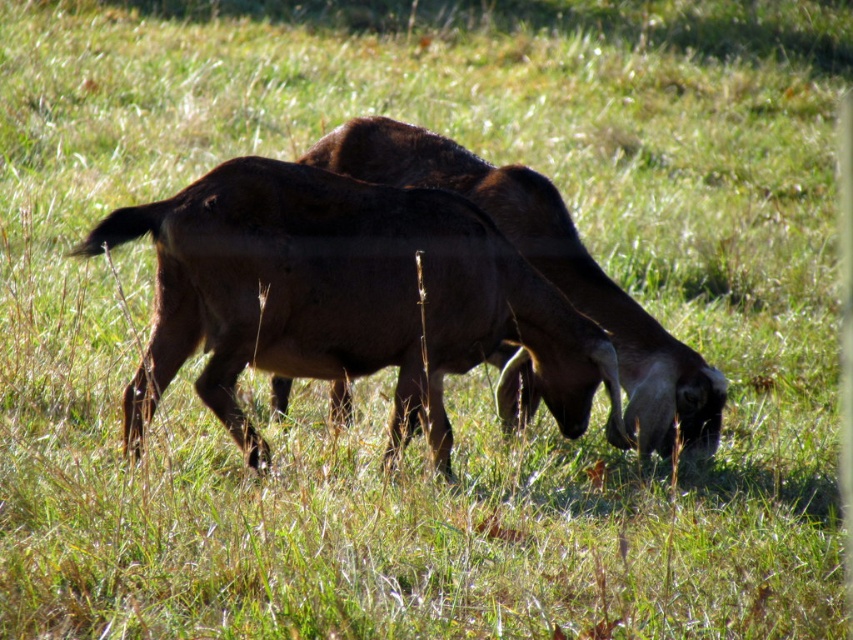
Where is the brown rough fur goat at center located in the image?

The brown rough fur goat at center is located at point (346, 298).

You are a farmer checking on your goats in the field. You notice two goats at center. Which one is positioned lower in the frame, the brown rough fur goat at center or the brown matte goat at center?

The brown rough fur goat at center is located below the brown matte goat at center, so it is positioned lower in the frame.

You are a farmer checking the grazing area. You see the brown rough fur goat at center and the brown matte goat at center. Which goat is shorter in height?

The brown rough fur goat at center is not as tall as the brown matte goat at center, so the brown rough fur goat at center is shorter.